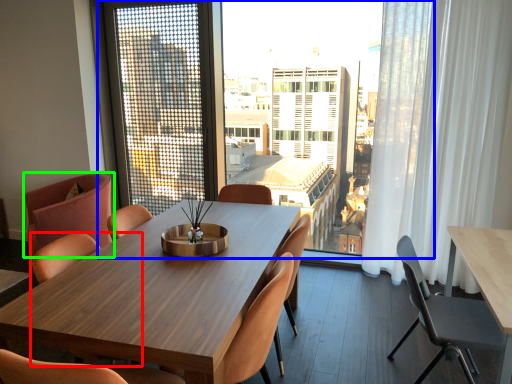
Question: Which object is the farthest from chair (highlighted by a red box)? Choose among these: window (highlighted by a blue box) or chair (highlighted by a green box).

Choices:
 (A) window
 (B) chair

Answer: (A)